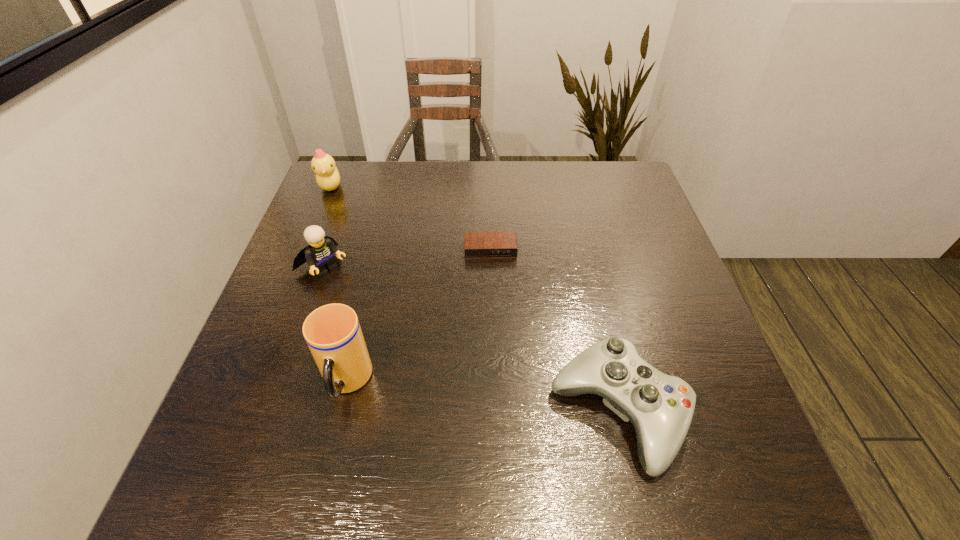
Where is `free space between the shortest object and the cup`? Image resolution: width=960 pixels, height=540 pixels. free space between the shortest object and the cup is located at coordinates (419, 316).

Identify the location of free space that is in between the alarm clock and the rightmost object. The image size is (960, 540). (554, 331).

Identify the location of vacant area that lies between the shortest object and the Lego. (407, 258).

Locate an element on the screen. The width and height of the screenshot is (960, 540). free space between the farthest object and the Lego is located at coordinates (326, 227).

Locate an element on the screen. The width and height of the screenshot is (960, 540). vacant region between the cup and the duckling is located at coordinates (339, 285).

Where is `free spot between the control and the Lego`? free spot between the control and the Lego is located at coordinates (470, 339).

Identify the location of free space between the Lego and the duckling. tap(326, 227).

You are a GUI agent. You are given a task and a screenshot of the screen. Output one action in this format:
    pyautogui.click(x=<x>, y=<y>)
    Task: Click on the free space between the second shortest object and the Lego
    
    Given the screenshot: What is the action you would take?
    click(470, 339)

You are a GUI agent. You are given a task and a screenshot of the screen. Output one action in this format:
    pyautogui.click(x=<x>, y=<y>)
    Task: Click on the free space between the Lego and the fourth object from left to right
    
    Given the screenshot: What is the action you would take?
    pyautogui.click(x=407, y=258)

Locate an element on the screen. The height and width of the screenshot is (540, 960). free area in between the duckling and the third object from right to left is located at coordinates (339, 285).